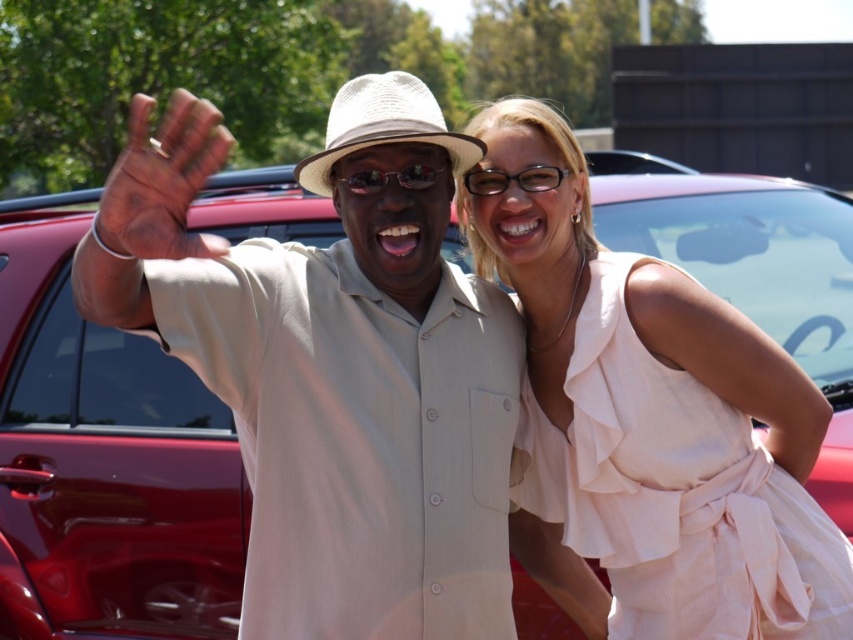
You are a photographer trying to capture a photo of the metallic red car at center and the sunglasses at center. Which object is positioned higher in the image?

The sunglasses at center are positioned higher than the metallic red car at center in the image.

You are standing in front of the red car and want to move towards the two points marked in the image. Which point, point (180, 106) or point (496, 177), is closer to you?

Point (180, 106) is closer to the viewer than point (496, 177), so you should move towards point (180, 106) first.